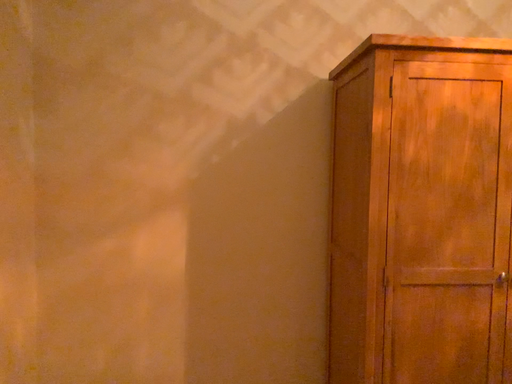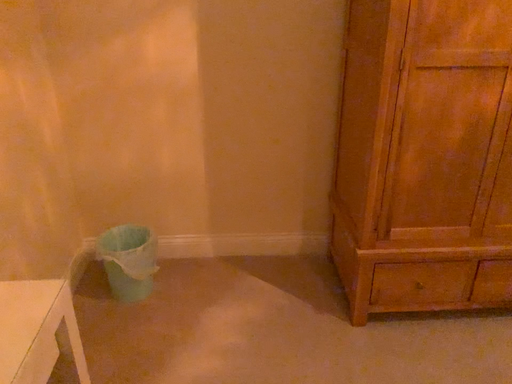
Question: How did the camera likely rotate when shooting the video?

Choices:
 (A) rotated upward
 (B) rotated downward

Answer: (B)